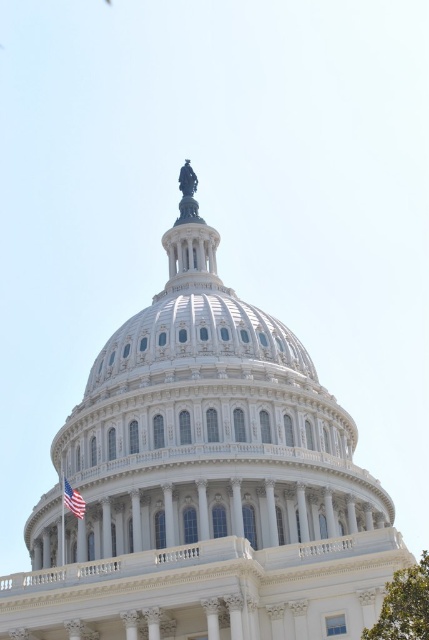
You are standing in front of the United States Capitol Building and want to take a photo that includes both the white marble dome at center and the green leafy tree at lower right. Based on their sizes, which object should appear smaller in your photo?

The white marble dome at center has a lesser width compared to the green leafy tree at lower right, so it should appear smaller in the photo.

From the picture: You are a photographer planning to capture the United States Capitol Building. You notice the white marble dome at center and the green leafy tree at lower right in your viewfinder. Based on their sizes in the image, which object would appear closer to you?

The green leafy tree at lower right appears closer because it is larger in the image compared to the white marble dome at center.

You are a photographer planning to capture the United States Capitol Building. You notice the white marble dome at center and the green leafy tree at lower right in your viewfinder. Which object appears larger in the photo?

The white marble dome at center appears larger in the photo because it is taller than the green leafy tree at lower right.